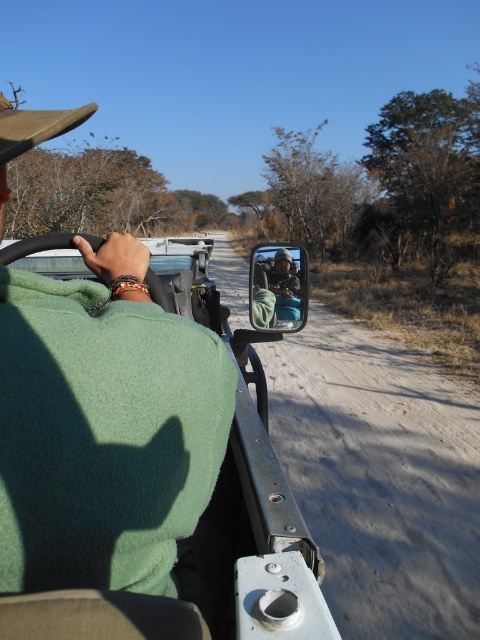
You are a passenger in the safari vehicle and want to place your belongings on the available space. Which object, the brown felt cowboy hat at upper left or the matte black jacket at center, is located higher up in the image?

The brown felt cowboy hat at upper left is positioned over the matte black jacket at center, so it is higher up in the image.

You are a safari guide in the vehicle. You need to check both the metallic side mirror at center and the matte black jacket at center. Which object is larger in size?

The metallic side mirror at center is bigger than the matte black jacket at center.

You are inside the safari vehicle and want to know if the point at coordinate (249, 484) is closer to you than the point at (8, 115). Based on the scene description, can you determine which point is nearer?

Point (249, 484) is further to the viewer than point (8, 115), so the latter is closer to you.